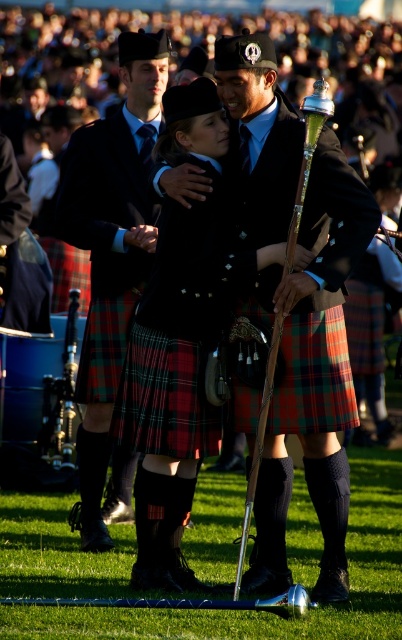
Who is more distant from viewer, (133, 150) or (322, 340)?

Positioned behind is point (133, 150).

Does point (127, 305) lie behind point (283, 371)?

Yes, point (127, 305) is behind point (283, 371).

The width and height of the screenshot is (402, 640). I want to click on matte black kilt at center, so point(112,262).

Does shiny black kilt at center lie in front of matte black kilt at center?

Yes.

Is point (336, 250) behind point (141, 259)?

That is False.

Does point (358, 184) lie in front of point (168, 52)?

Yes, it is in front of point (168, 52).

Locate an element on the screen. shiny black kilt at center is located at coordinates (293, 301).

Can you confirm if shiny black kilt at center is shorter than red plaid kilt at center?

Correct, shiny black kilt at center is not as tall as red plaid kilt at center.

In the scene shown: Is shiny black kilt at center positioned before red plaid kilt at center?

No, shiny black kilt at center is further to the viewer.

Who is more distant from viewer, (328, 456) or (317, 371)?

Point (317, 371)

Locate an element on the screen. Image resolution: width=402 pixels, height=640 pixels. shiny black kilt at center is located at coordinates (293, 301).